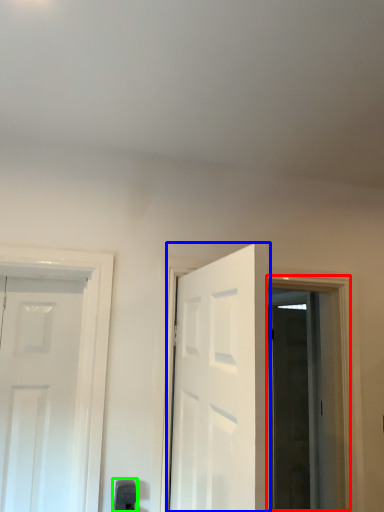
Question: Considering the real-world distances, which object is farthest from window (highlighted by a red box)? door (highlighted by a blue box) or door handle (highlighted by a green box)?

Choices:
 (A) door
 (B) door handle

Answer: (B)